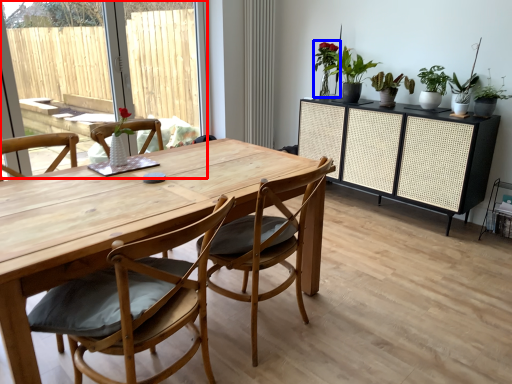
Question: Which of the following is the farthest to the observer, window screen (highlighted by a red box) or plant (highlighted by a blue box)?

Choices:
 (A) window screen
 (B) plant

Answer: (B)